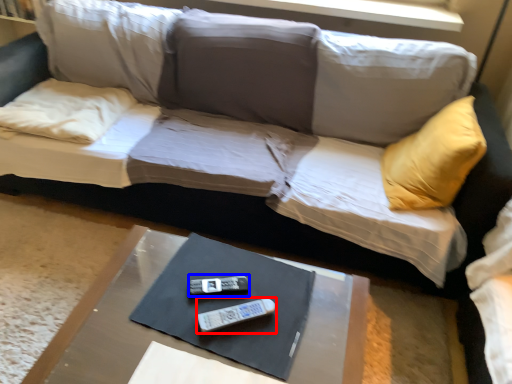
Question: Which of the following is the farthest to the observer, remote (highlighted by a red box) or remote (highlighted by a blue box)?

Choices:
 (A) remote
 (B) remote

Answer: (B)